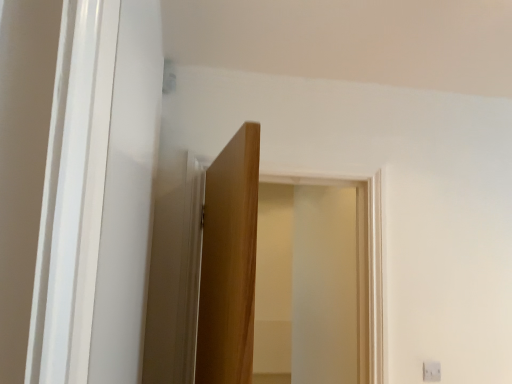
Describe the element at coordinates (312, 284) in the screenshot. This screenshot has width=512, height=384. I see `transparent glass door at center` at that location.

Measure the distance between transparent glass door at center and camera.

7.71 feet.

What are the coordinates of `transparent glass door at center` in the screenshot? It's located at (312, 284).

You are a GUI agent. You are given a task and a screenshot of the screen. Output one action in this format:
    pyautogui.click(x=<x>, y=<y>)
    Task: Click on the white plastic light switch at lower right
    This screenshot has height=384, width=512.
    Given the screenshot: What is the action you would take?
    pyautogui.click(x=431, y=371)

The image size is (512, 384). Describe the element at coordinates (431, 371) in the screenshot. I see `white plastic light switch at lower right` at that location.

Where is `transparent glass door at center`? This screenshot has width=512, height=384. transparent glass door at center is located at coordinates pos(312,284).

Which object is positioned more to the left, white plastic light switch at lower right or transparent glass door at center?

transparent glass door at center.

Does white plastic light switch at lower right come in front of transparent glass door at center?

That is False.

Does point (438, 365) come behind point (297, 219)?

That is False.

From the image's perspective, which is above, white plastic light switch at lower right or transparent glass door at center?

transparent glass door at center.

From a real-world perspective, is white plastic light switch at lower right physically located above or below transparent glass door at center?

Clearly, from a real-world perspective, white plastic light switch at lower right is below transparent glass door at center.

Considering the relative sizes of white plastic light switch at lower right and transparent glass door at center in the image provided, is white plastic light switch at lower right thinner than transparent glass door at center?

Yes.

Between white plastic light switch at lower right and transparent glass door at center, which one has less height?

white plastic light switch at lower right.

Does white plastic light switch at lower right have a larger size compared to transparent glass door at center?

No.

Is white plastic light switch at lower right not inside transparent glass door at center?

white plastic light switch at lower right lies outside transparent glass door at center's area.

Is there a large distance between white plastic light switch at lower right and transparent glass door at center?

That's right, there is a large distance between white plastic light switch at lower right and transparent glass door at center.

Consider the image. Is white plastic light switch at lower right oriented away from transparent glass door at center?

No, transparent glass door at center is not at the back of white plastic light switch at lower right.

How distant is white plastic light switch at lower right from transparent glass door at center?

The distance of white plastic light switch at lower right from transparent glass door at center is 3.76 feet.

I want to click on window in front of the white plastic light switch at lower right, so click(x=312, y=284).

Is transparent glass door at center at the left side of white plastic light switch at lower right?

Correct, you'll find transparent glass door at center to the left of white plastic light switch at lower right.

Considering their positions, is transparent glass door at center located in front of or behind white plastic light switch at lower right?

transparent glass door at center is in front of white plastic light switch at lower right.

Is point (326, 350) more distant than point (436, 369)?

Yes, point (326, 350) is behind point (436, 369).

From the image's perspective, who appears lower, transparent glass door at center or white plastic light switch at lower right?

white plastic light switch at lower right.

Based on the photo, from a real-world perspective, is transparent glass door at center physically located above or below white plastic light switch at lower right?

transparent glass door at center is above white plastic light switch at lower right.

Considering the sizes of objects transparent glass door at center and white plastic light switch at lower right in the image provided, who is wider, transparent glass door at center or white plastic light switch at lower right?

With larger width is transparent glass door at center.

Does transparent glass door at center have a greater height compared to white plastic light switch at lower right?

Yes, transparent glass door at center is taller than white plastic light switch at lower right.

Does transparent glass door at center have a smaller size compared to white plastic light switch at lower right?

No.

Choose the correct answer: Is transparent glass door at center inside white plastic light switch at lower right or outside it?

transparent glass door at center is not enclosed by white plastic light switch at lower right.

Is the surface of transparent glass door at center in direct contact with white plastic light switch at lower right?

transparent glass door at center and white plastic light switch at lower right are clearly separated.

Does transparent glass door at center turn towards white plastic light switch at lower right?

No, transparent glass door at center is not aimed at white plastic light switch at lower right.

Based on the photo, how distant is transparent glass door at center from white plastic light switch at lower right?

transparent glass door at center and white plastic light switch at lower right are 3.76 feet apart.

Identify the location of window located in front of the white plastic light switch at lower right. (312, 284).

Image resolution: width=512 pixels, height=384 pixels. What are the coordinates of `light switch behind the transparent glass door at center` in the screenshot? It's located at (431, 371).

In the image, there is a transparent glass door at center. Find the location of `light switch below it (from a real-world perspective)`. light switch below it (from a real-world perspective) is located at coordinates [431, 371].